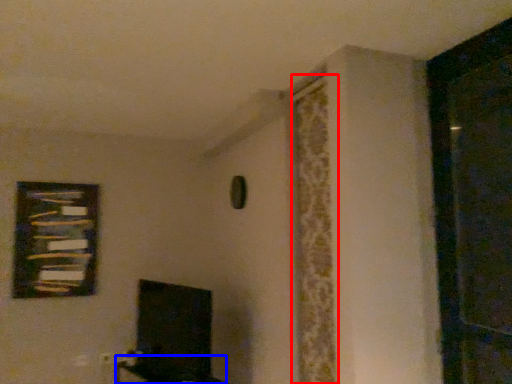
Question: Which object is closer to the camera taking this photo, curtain (highlighted by a red box) or furniture (highlighted by a blue box)?

Choices:
 (A) curtain
 (B) furniture

Answer: (A)